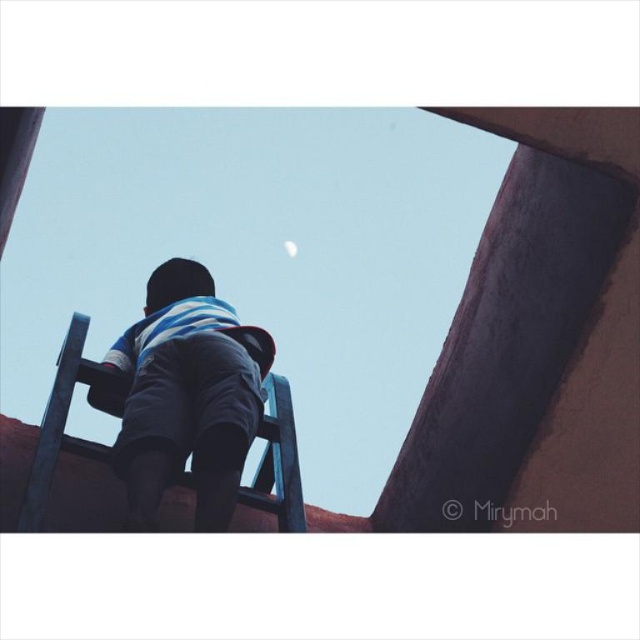
Who is more distant from viewer, (177, 422) or (294, 256)?

Positioned behind is point (294, 256).

Is point (163, 344) less distant than point (289, 243)?

Yes, point (163, 344) is closer to viewer.

Image resolution: width=640 pixels, height=640 pixels. In order to click on blue striped shirt at center in this screenshot , I will do `click(188, 394)`.

At what (x,y) coordinates should I click in order to perform the action: click on blue striped shirt at center. Please return your answer as a coordinate pair (x, y). Image resolution: width=640 pixels, height=640 pixels. Looking at the image, I should click on (188, 394).